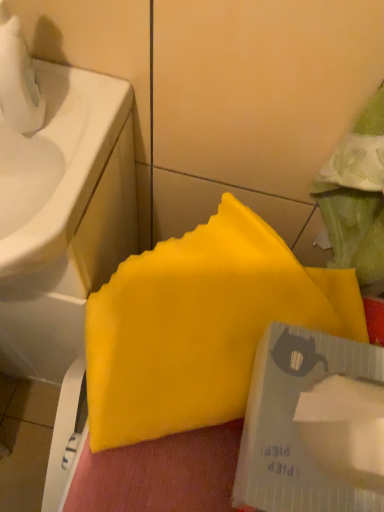
In order to face transparent plastic tape at lower right, should I rotate leftwards or rightwards?

You should look right and rotate roughly 19.960 degrees.

Describe the element at coordinates (200, 325) in the screenshot. The image size is (384, 512). I see `yellow matte paper at center` at that location.

This screenshot has height=512, width=384. I want to click on white glossy sink at left, so click(x=56, y=164).

Is there a large distance between white glossy sink at left and yellow matte paper at center?

They are positioned close to each other.

Is white glossy sink at left inside the boundaries of yellow matte paper at center, or outside?

white glossy sink at left exists outside the volume of yellow matte paper at center.

From a real-world perspective, relative to yellow matte paper at center, is white glossy sink at left vertically above or below?

white glossy sink at left is above yellow matte paper at center.

Is point (93, 112) closer or farther from the camera than point (195, 327)?

Point (93, 112) is positioned farther from the camera compared to point (195, 327).

From the image's perspective, is yellow matte paper at center on top of transparent plastic tape at lower right?

Yes, from the image's perspective, yellow matte paper at center is above transparent plastic tape at lower right.

Can transparent plastic tape at lower right be found inside yellow matte paper at center?

That's incorrect, transparent plastic tape at lower right is not inside yellow matte paper at center.

Which of these two, yellow matte paper at center or transparent plastic tape at lower right, is smaller?

With smaller size is transparent plastic tape at lower right.

Could you tell me if yellow matte paper at center is facing transparent plastic tape at lower right?

No, yellow matte paper at center is not turned towards transparent plastic tape at lower right.

Are transparent plastic tape at lower right and white glossy sink at left making contact?

No, transparent plastic tape at lower right is not touching white glossy sink at left.

Who is shorter, transparent plastic tape at lower right or white glossy sink at left?

Standing shorter between the two is white glossy sink at left.

How many degrees apart are the facing directions of transparent plastic tape at lower right and white glossy sink at left?

transparent plastic tape at lower right and white glossy sink at left are facing 87.1 degrees away from each other.

In terms of width, does yellow matte paper at center look wider or thinner when compared to white glossy sink at left?

yellow matte paper at center is thinner than white glossy sink at left.

Is point (315, 308) closer or farther from the camera than point (58, 162)?

Point (315, 308).

From the image's perspective, would you say yellow matte paper at center is positioned over white glossy sink at left?

Actually, yellow matte paper at center appears below white glossy sink at left in the image.

Locate an element on the screen. The width and height of the screenshot is (384, 512). writing that is above the white glossy sink at left (from a real-world perspective) is located at coordinates (292, 422).

From the image's perspective, is white glossy sink at left under transparent plastic tape at lower right?

No, from the image's perspective, white glossy sink at left is not below transparent plastic tape at lower right.

Which is nearer, (26,236) or (361,357)?

Point (26,236).

Considering the relative sizes of transparent plastic tape at lower right and yellow matte paper at center in the image provided, is transparent plastic tape at lower right smaller than yellow matte paper at center?

Yes.

From the image's perspective, is transparent plastic tape at lower right located above or below yellow matte paper at center?

transparent plastic tape at lower right is below yellow matte paper at center.

Is point (291, 426) behind point (111, 378)?

No, (291, 426) is in front of (111, 378).

Can you confirm if transparent plastic tape at lower right is taller than yellow matte paper at center?

Yes, transparent plastic tape at lower right is taller than yellow matte paper at center.

Locate an element on the screen. waste behind the white glossy sink at left is located at coordinates (200, 325).

I want to click on writing above the yellow matte paper at center (from a real-world perspective), so click(x=292, y=422).

When comparing their distances from yellow matte paper at center, does white glossy sink at left or transparent plastic tape at lower right seem closer?

transparent plastic tape at lower right lies closer to yellow matte paper at center than the other object.

Which object lies nearer to the anchor point transparent plastic tape at lower right, white glossy sink at left or yellow matte paper at center?

The object closer to transparent plastic tape at lower right is yellow matte paper at center.

Considering their positions, is yellow matte paper at center positioned closer to white glossy sink at left than transparent plastic tape at lower right?

Answer: yellow matte paper at center lies closer to white glossy sink at left than the other object.

Estimate the real-world distances between objects in this image. Which object is closer to white glossy sink at left, transparent plastic tape at lower right or yellow matte paper at center?

Among the two, yellow matte paper at center is located nearer to white glossy sink at left.

Estimate the real-world distances between objects in this image. Which object is further from transparent plastic tape at lower right, yellow matte paper at center or white glossy sink at left?

Based on the image, white glossy sink at left appears to be further to transparent plastic tape at lower right.

Estimate the real-world distances between objects in this image. Which object is further from yellow matte paper at center, transparent plastic tape at lower right or white glossy sink at left?

white glossy sink at left is positioned further to the anchor yellow matte paper at center.

I want to click on waste situated between white glossy sink at left and transparent plastic tape at lower right from left to right, so click(x=200, y=325).